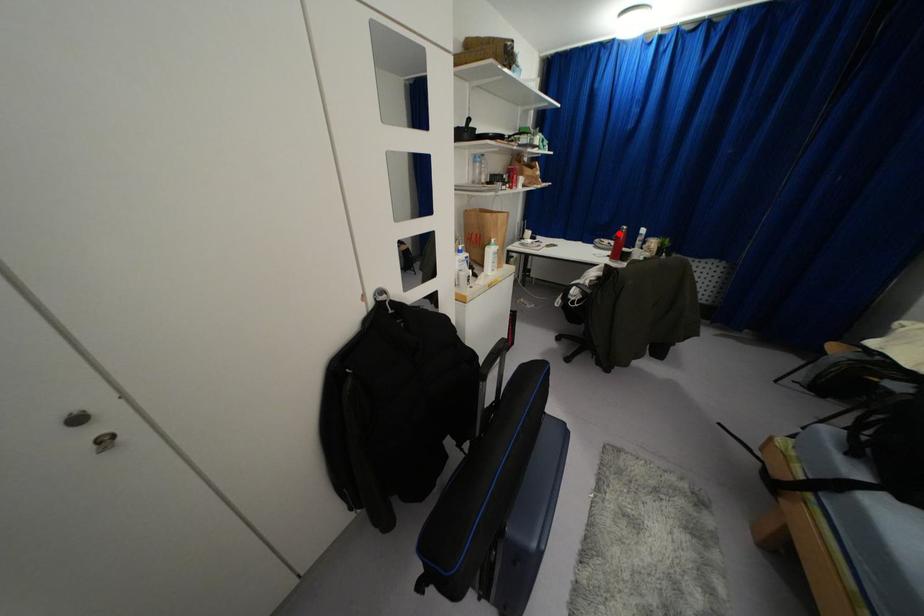
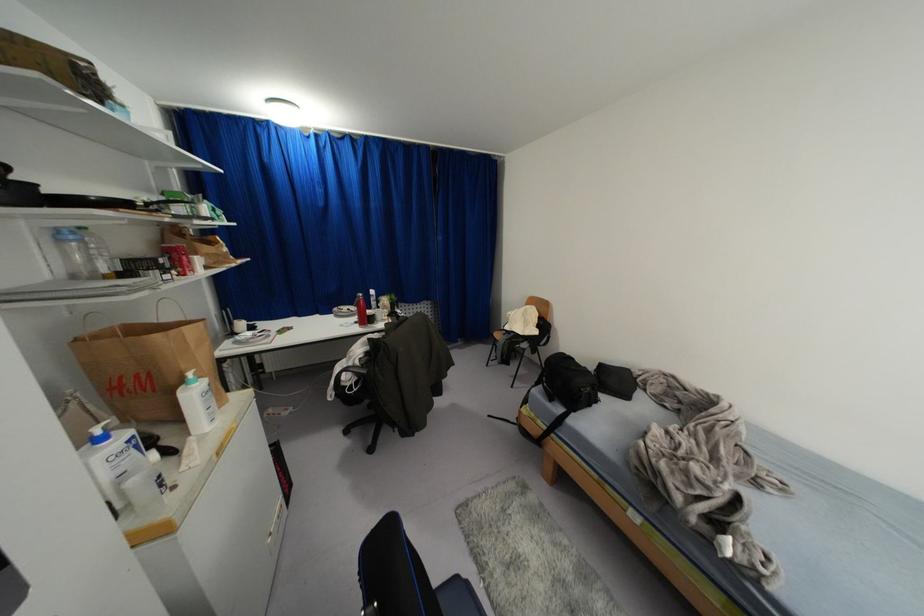
The point at the highlighted location is marked in the first image. Where is the corresponding point in the second image?

(359, 301)